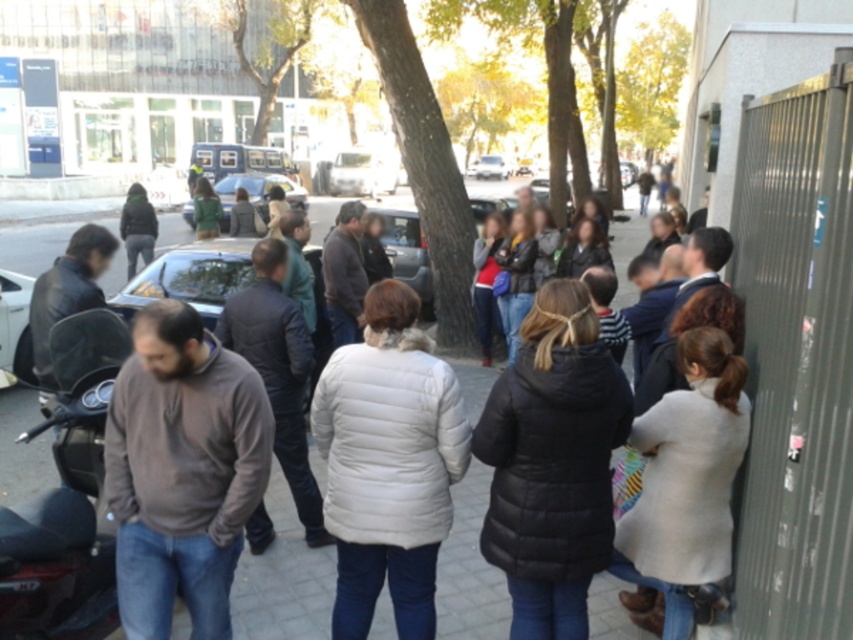
Is brown sweater at center to the right of gray quilted jacket at center from the viewer's perspective?

Yes, brown sweater at center is to the right of gray quilted jacket at center.

This screenshot has height=640, width=853. What do you see at coordinates (183, 470) in the screenshot? I see `brown sweater at center` at bounding box center [183, 470].

What do you see at coordinates (183, 470) in the screenshot? The image size is (853, 640). I see `brown sweater at center` at bounding box center [183, 470].

Locate an element on the screen. This screenshot has width=853, height=640. brown sweater at center is located at coordinates (183, 470).

Between point (587, 355) and point (12, 509), which one is positioned behind?

The point (12, 509) is more distant.

Can you confirm if black puffy coat at center is positioned above black matte motorcycle at left?

No, black puffy coat at center is not above black matte motorcycle at left.

I want to click on black puffy coat at center, so click(x=552, y=461).

Is point (329, 168) closer to camera compared to point (242, 205)?

That is False.

Can you confirm if metallic silver van at center is positioned below dark gray jacket at center?

Actually, metallic silver van at center is above dark gray jacket at center.

Where is `metallic silver van at center`? metallic silver van at center is located at coordinates (355, 173).